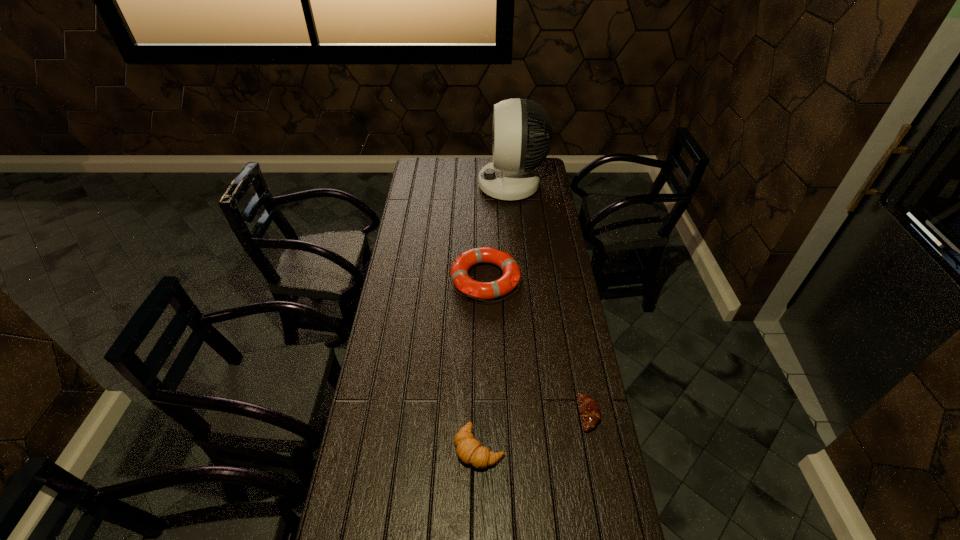
Select which crescent roll appears as the second closest to the tallest object. Please provide its 2D coordinates. Your answer should be formatted as a tuple, i.e. [(x, y)], where the tuple contains the x and y coordinates of a point satisfying the conditions above.

[(468, 449)]

The image size is (960, 540). I want to click on vacant position in the image that satisfies the following two spatial constraints: 1. on the grille of the farthest object; 2. on the front side of the life buoy, so click(x=521, y=279).

The width and height of the screenshot is (960, 540). What are the coordinates of `free spot that satisfies the following two spatial constraints: 1. on the front side of the shorter crescent roll; 2. on the right side of the third shortest object` in the screenshot? It's located at (487, 414).

Where is `free location that satisfies the following two spatial constraints: 1. on the grille of the farthest object; 2. on the right side of the right crescent roll`? free location that satisfies the following two spatial constraints: 1. on the grille of the farthest object; 2. on the right side of the right crescent roll is located at coordinates (534, 414).